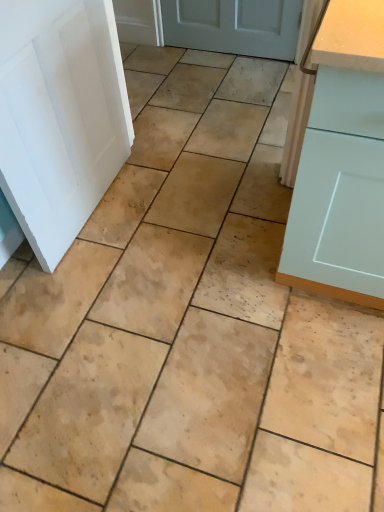
Identify the location of free spot in front of white matte door at left. Image resolution: width=384 pixels, height=512 pixels. (114, 287).